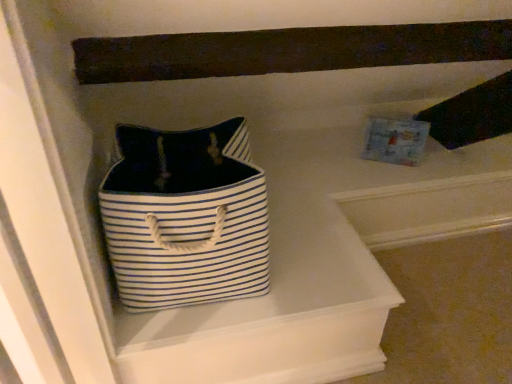
Find the location of `white striped fabric bag at center`. white striped fabric bag at center is located at coordinates (x=185, y=217).

This screenshot has width=512, height=384. Describe the element at coordinates (185, 217) in the screenshot. I see `white striped fabric bag at center` at that location.

Locate an element on the screen. white striped fabric bag at center is located at coordinates (185, 217).